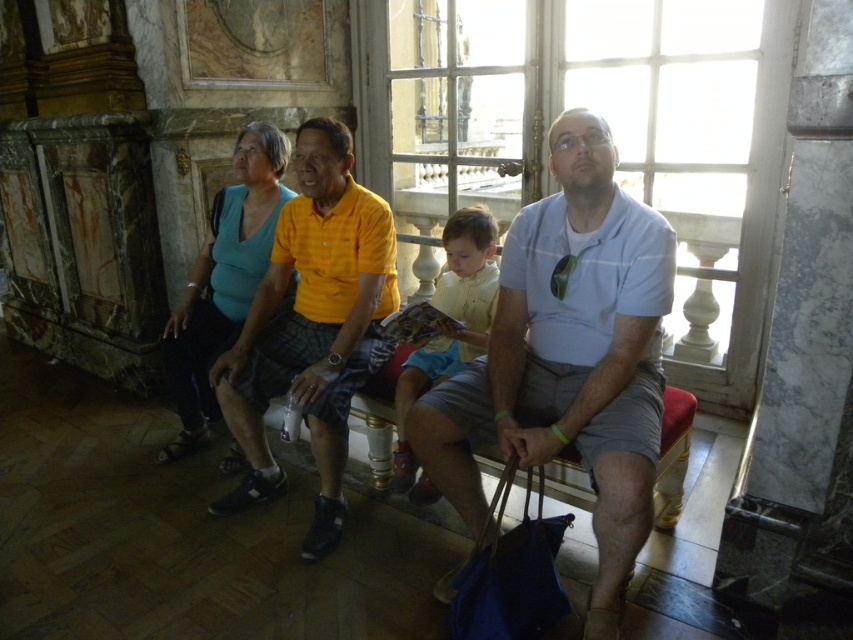
You are a photographer planning to take a group photo of the teal fabric shirt at center and the yellow cotton shirt at center. Which of these two shirts should you focus on first if you want to capture the larger one in detail?

The teal fabric shirt at center is bigger than the yellow cotton shirt at center, so you should focus on the teal fabric shirt at center first to capture its larger size in detail.

You are standing in front of the bench and want to hand a gift to the person wearing the matte yellow shirt at center. Which direction should you walk to reach them?

You should walk towards the center of the bench to reach the person wearing the matte yellow shirt at center since they are located at point (312, 326).